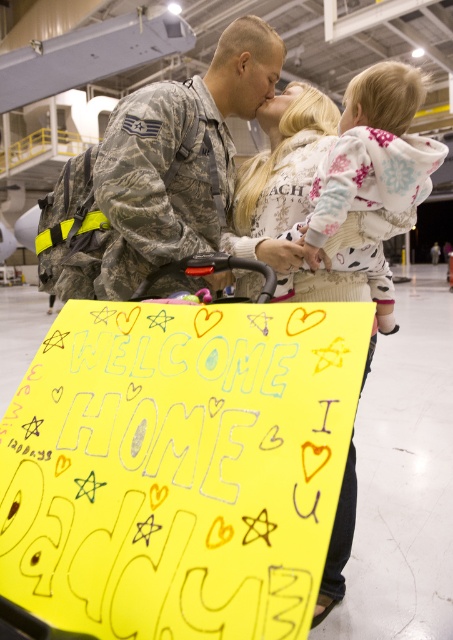
You are a photographer at the scene and want to capture a photo where both the camouflage uniform at center and the white fleece sweater at center are clearly visible. Given their sizes, which object should you focus on to ensure both are in frame without cropping?

Since the camouflage uniform at center is smaller than the white fleece sweater at center, you should focus on the camouflage uniform at center as it requires less space to capture both objects in the frame.

You are a photographer positioned at the entrance of the hangar. You need to capture a photo that includes both the camouflage uniform at center and the white fleece hoodie at upper center. What is the minimum distance you should set your camera lens to ensure both subjects are in frame?

The camouflage uniform at center is 39.34 centimeters from the white fleece hoodie at upper center. To include both in the frame, the camera lens should be set to a focal length that can capture objects within a 39.34 centimeter distance apart.

You are a photographer at the scene and want to capture the camouflage uniform at center in your shot. What are the coordinates where you should focus your camera?

The camouflage uniform at center is located at coordinates point (173,157).